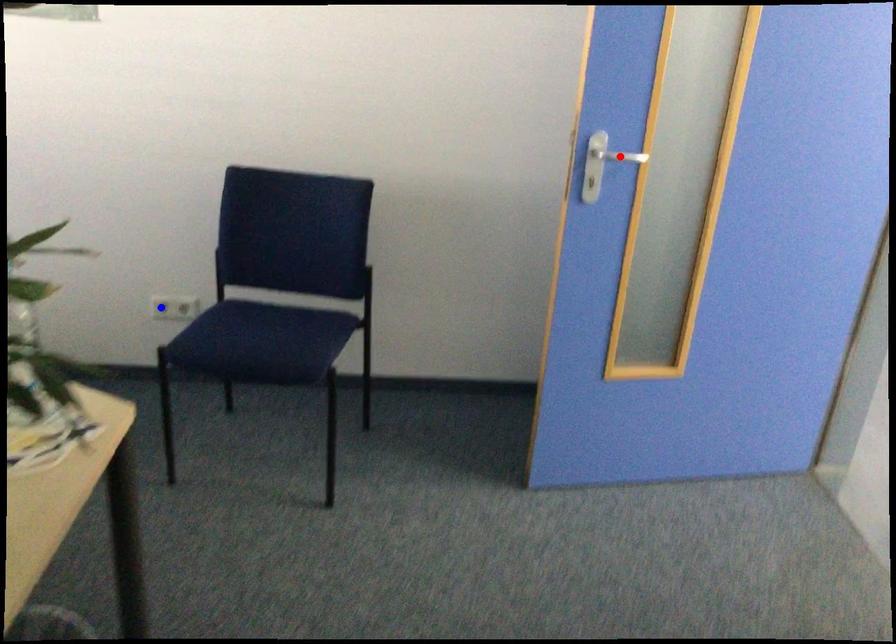
Question: Two points are marked on the image. Which point is closer to the camera?

Choices:
 (A) Blue point is closer.
 (B) Red point is closer.

Answer: (B)